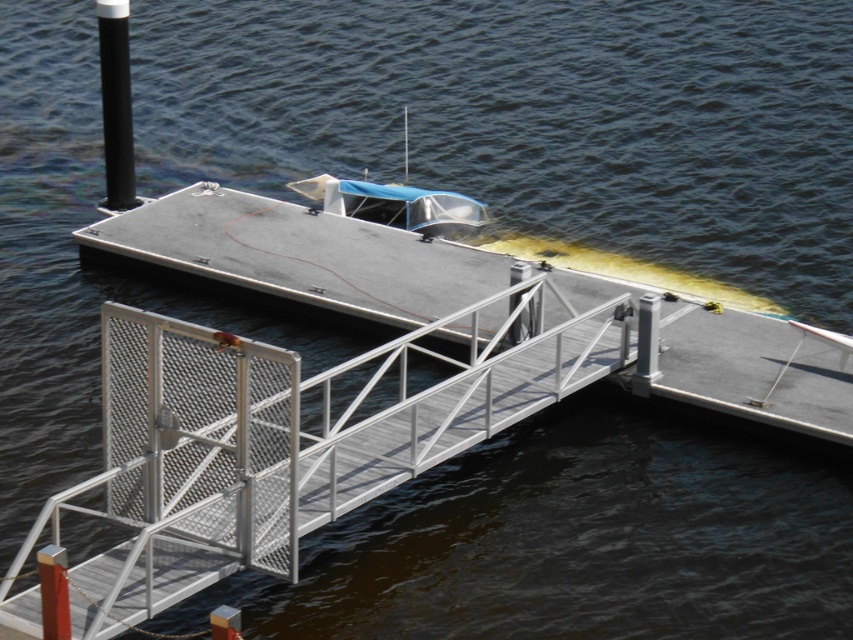
Does point (108, 314) lie in front of point (109, 93)?

That is True.

Which is above, metallic silver rail at center or black matte pole at upper left?

black matte pole at upper left

Who is more distant from viewer, (238, 460) or (129, 188)?

The point (129, 188) is more distant.

This screenshot has width=853, height=640. I want to click on metallic silver rail at center, so click(297, 436).

Does point (254, 268) lie behind point (108, 134)?

No.

Who is lower down, metallic gray boat at center or black matte pole at upper left?

metallic gray boat at center is lower down.

What do you see at coordinates (480, 292) in the screenshot? I see `metallic gray boat at center` at bounding box center [480, 292].

Where is `metallic gray boat at center`? The image size is (853, 640). metallic gray boat at center is located at coordinates (480, 292).

Which is behind, point (379, 388) or point (341, 294)?

The point (341, 294) is more distant.

Who is more forward, (279, 403) or (296, 260)?

Point (279, 403) is more forward.

At what (x,y) coordinates should I click in order to perform the action: click on metallic silver rail at center. Please return your answer as a coordinate pair (x, y). The width and height of the screenshot is (853, 640). Looking at the image, I should click on (297, 436).